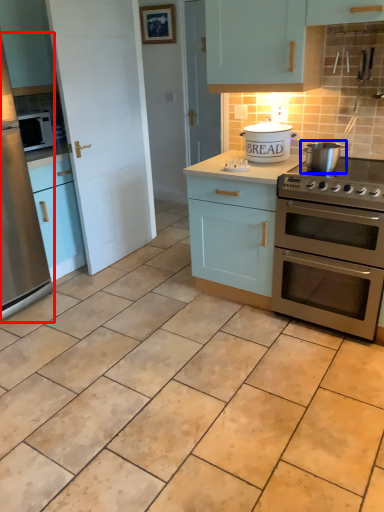
Question: Which of the following is the farthest to the observer, fridge (highlighted by a red box) or appliance (highlighted by a blue box)?

Choices:
 (A) fridge
 (B) appliance

Answer: (B)